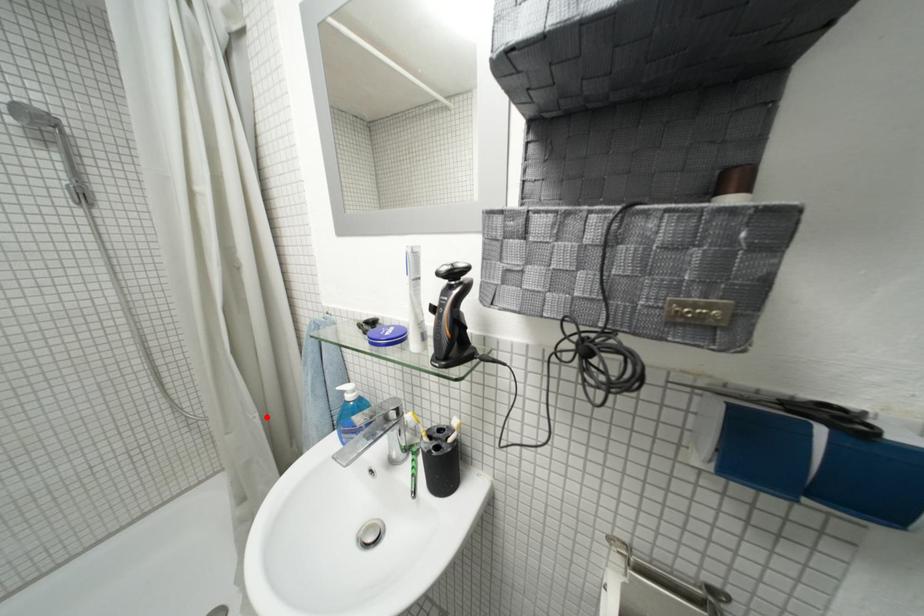
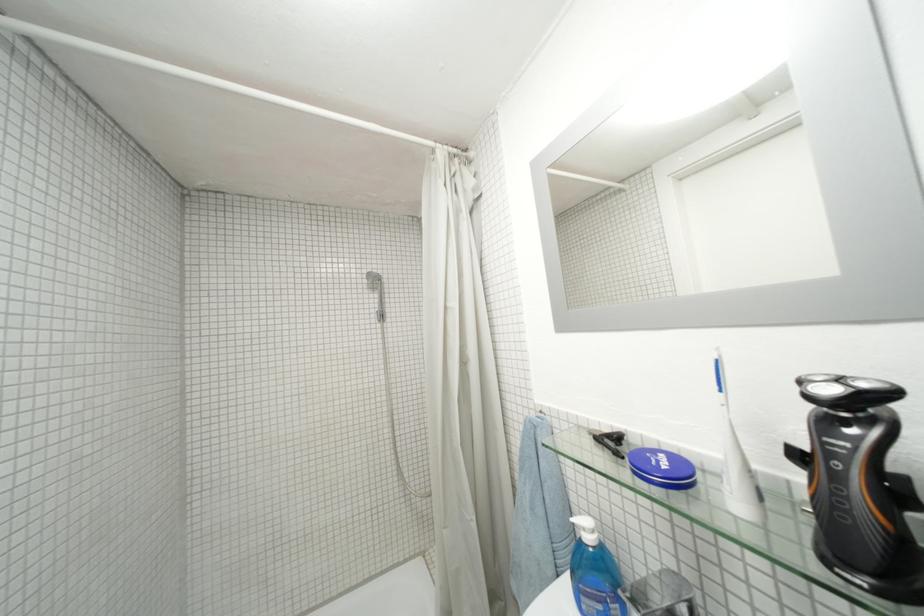
Find the pixel in the second image that matches the highlighted location in the first image.

(482, 521)